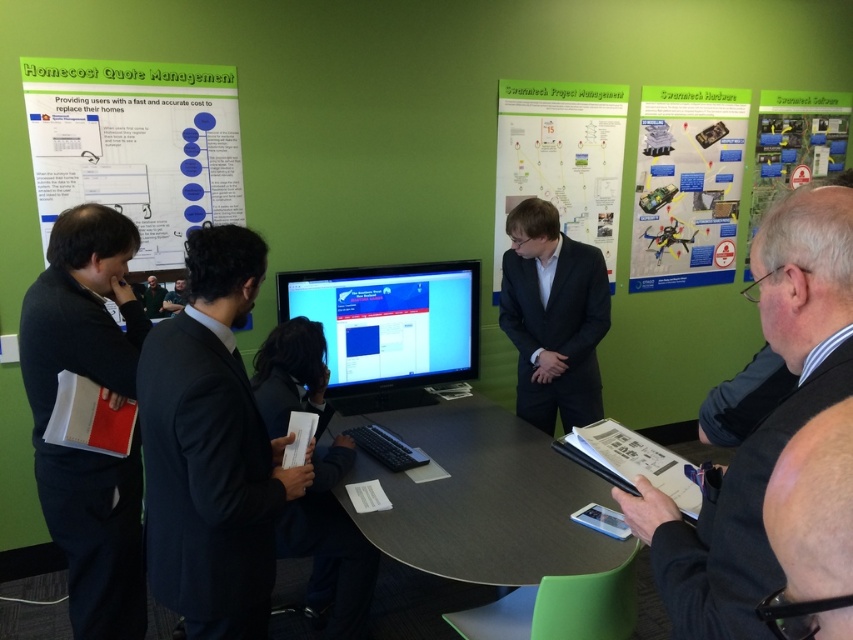
You are organizing a meeting in this room and need to ensure that the dark blue woolen suit at center and the matte black laptop at upper left can both fit on the table. Given that the table has limited space, which object requires more horizontal space?

The dark blue woolen suit at center requires more horizontal space because its width is larger than that of the matte black laptop at upper left.